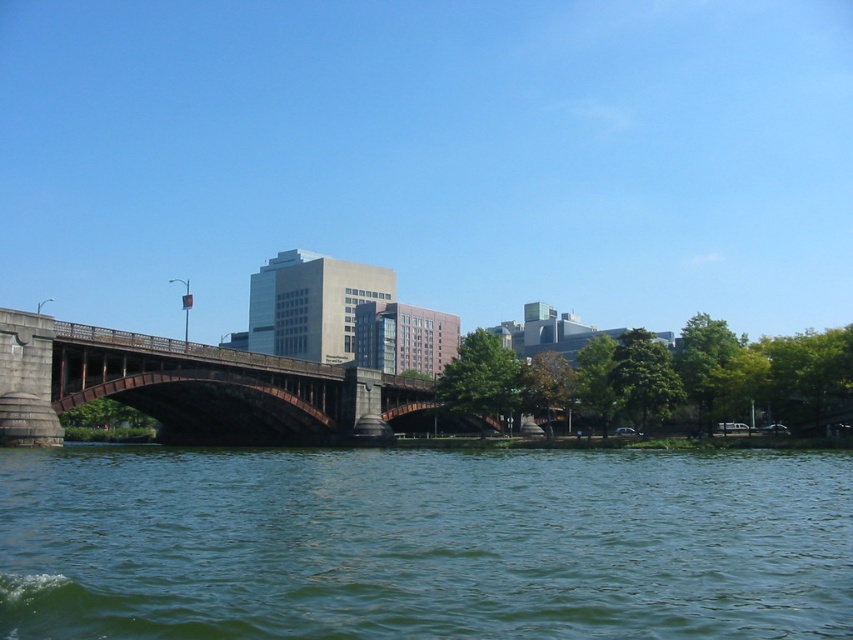
You are a photographer standing at the riverside. You want to capture a photo of both the green water at lower center and the brown stone bridge at center. Based on their positions, which object should you adjust your camera to focus on first to ensure both are in the frame?

The green water at lower center is positioned on the right side of the brown stone bridge at center. To include both in the frame, focus on the brown stone bridge at center first as it is centrally located, then adjust to ensure the green water at lower center on its right is also captured.

You are a boat captain planning to navigate through the green water at lower center. The brown stone bridge at center is in your path. Based on the scene description, can your boat pass under the bridge without any issues?

The green water at lower center has a smaller size compared to the brown stone bridge at center, so the boat can pass under the bridge since the bridge is larger and provides sufficient clearance.